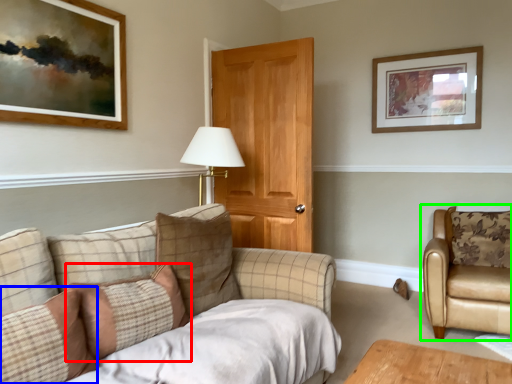
Question: Considering the real-world distances, which object is closest to pillow (highlighted by a red box)? pillow (highlighted by a blue box) or chair (highlighted by a green box).

Choices:
 (A) pillow
 (B) chair

Answer: (A)